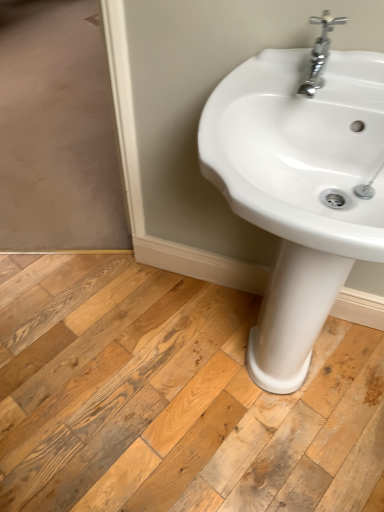
This screenshot has height=512, width=384. I want to click on blank space above natural wood floor at center (from a real-world perspective), so click(x=157, y=349).